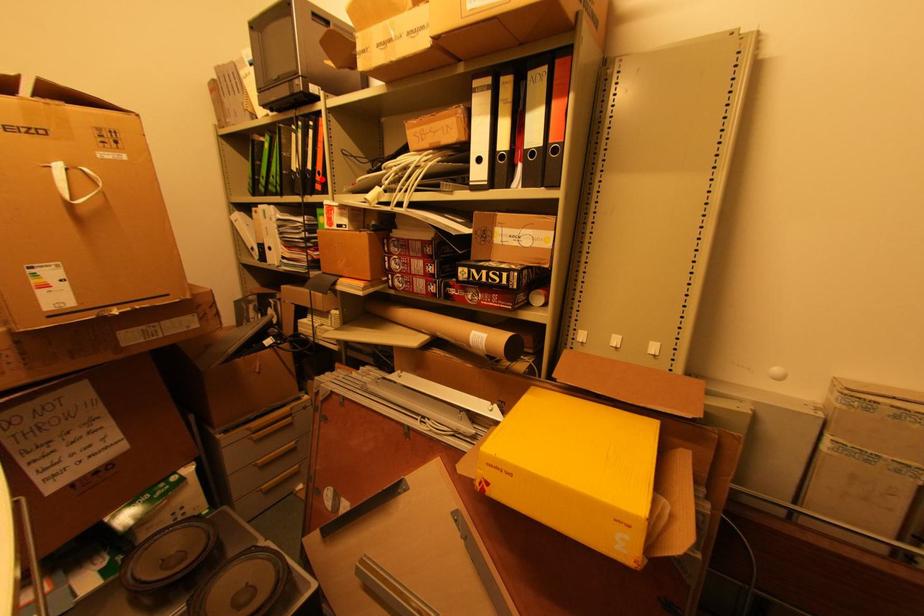
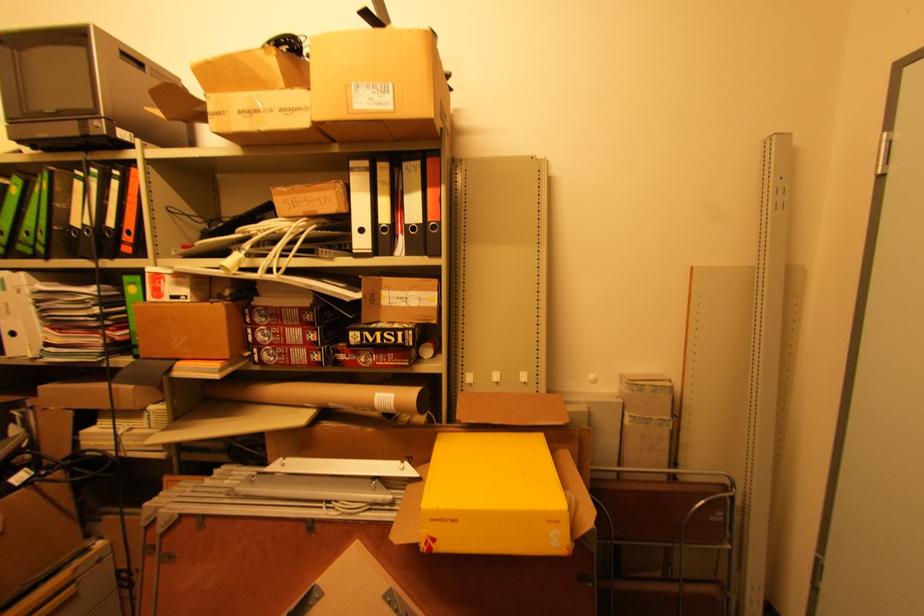
Find the pixel in the second image that matches the highlighted location in the first image.

(131, 238)